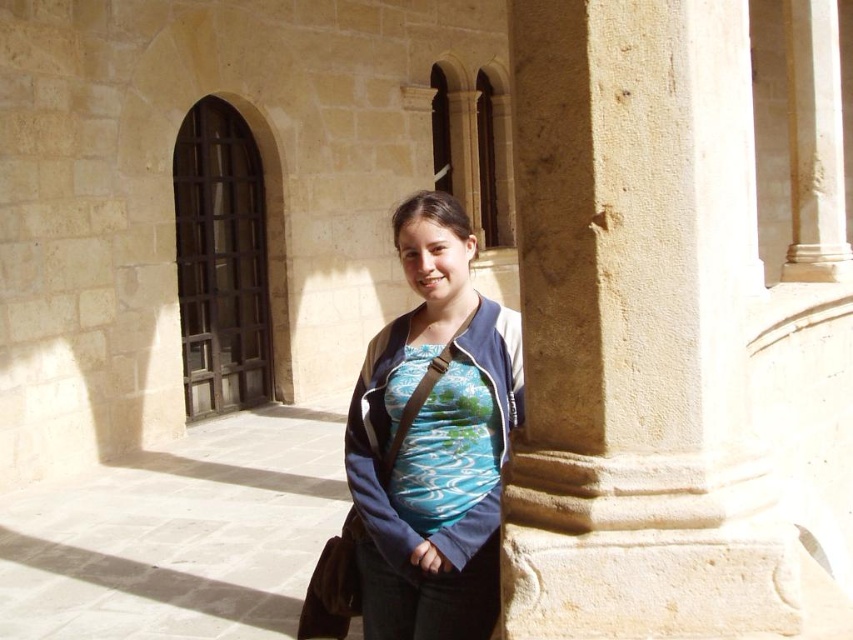
You are a fashion designer observing a person wearing two shirts, a blue fabric shirt at center and a textured fabric shirt at center. Which shirt is bigger in size?

The blue fabric shirt at center is larger in size compared to the textured fabric shirt at center.

You are a fashion designer observing the person in the image. You notice the blue fabric shirt at center and the textured fabric shirt at center. Which one is positioned higher on the person?

The blue fabric shirt at center is above the textured fabric shirt at center, so the blue fabric shirt at center is positioned higher on the person.

You are taking a photo of the stone building and notice two points marked on your camera screen. The first point is at coordinates point (364,465) and the second is at point (463,477). Which point is closer to the camera?

Point (364,465) is further to the camera than point (463,477), so the second point is closer to the camera.